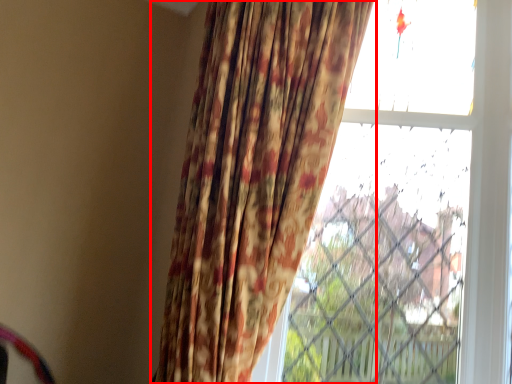
Question: Observing the image, what is the correct spatial positioning of curtain (annotated by the red box) in reference to window?

Choices:
 (A) right
 (B) left

Answer: (B)